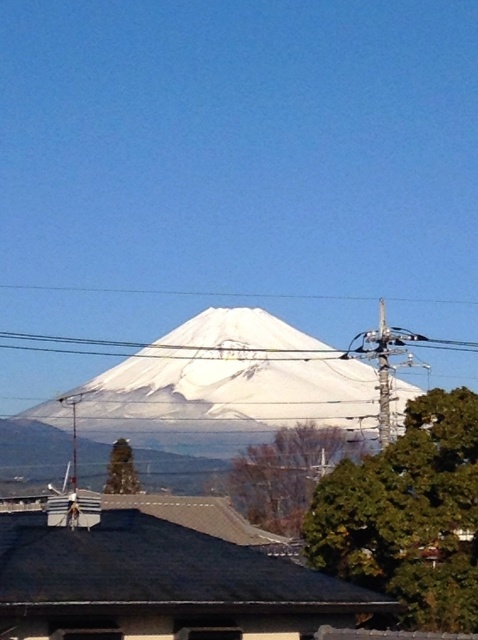
Question: Is white snow-covered mountain peak at center below white plastic power line at center?

Choices:
 (A) no
 (B) yes

Answer: (B)

Question: Does white snow-covered mountain peak at center have a smaller size compared to white plastic power line at center?

Choices:
 (A) no
 (B) yes

Answer: (A)

Question: Is white snow-covered mountain peak at center closer to camera compared to white plastic power line at center?

Choices:
 (A) yes
 (B) no

Answer: (A)

Question: Which point appears farthest from the camera in this image?

Choices:
 (A) (18, 332)
 (B) (181, 369)

Answer: (A)